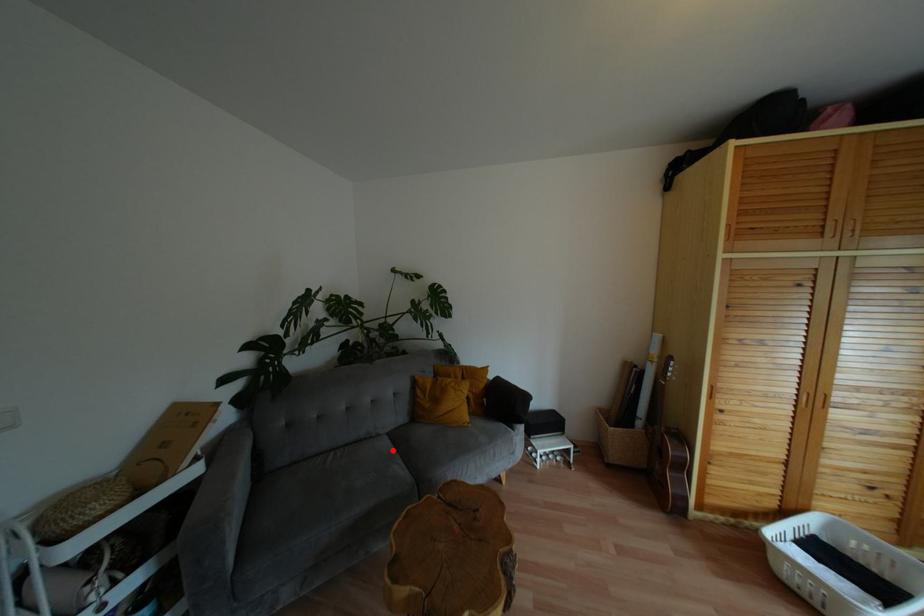
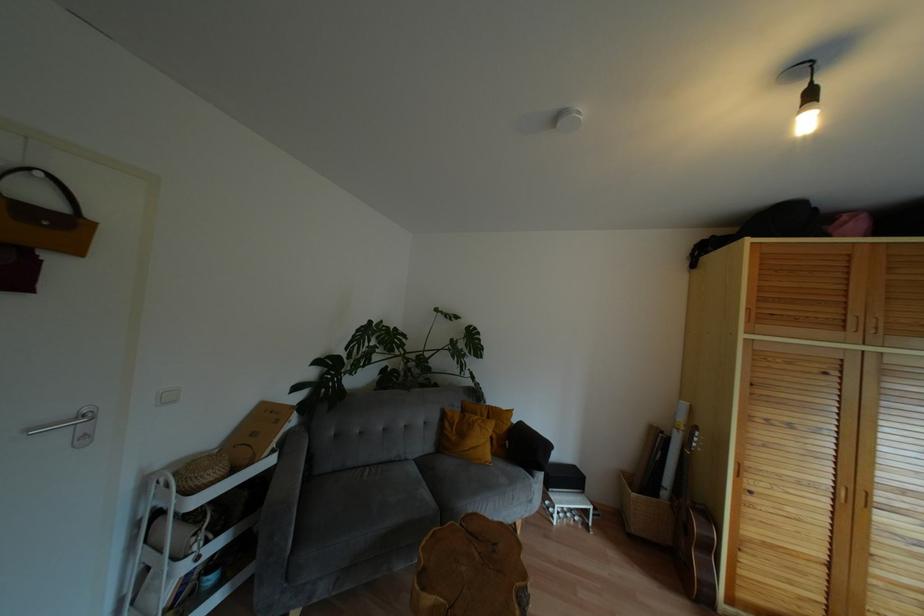
The point at the highlighted location is marked in the first image. Where is the corresponding point in the second image?

(419, 476)